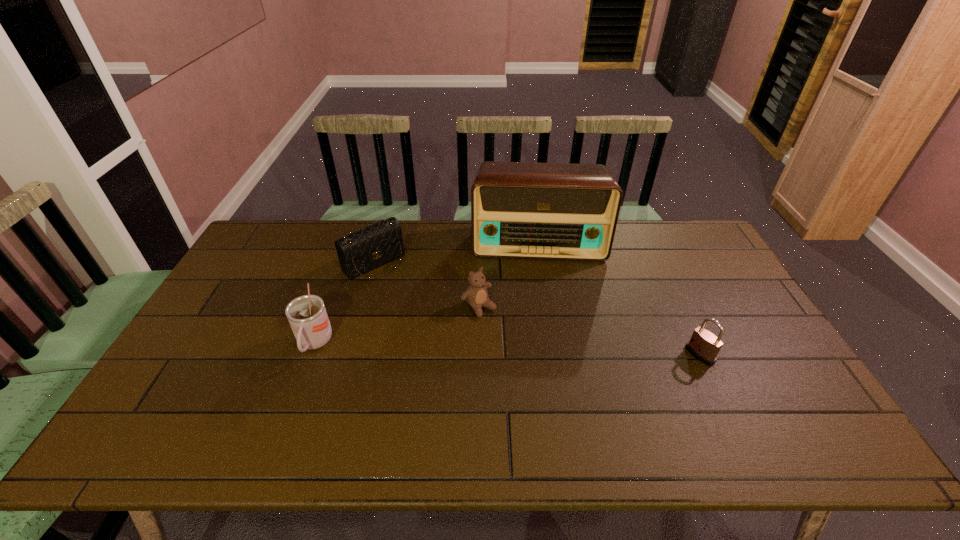
Locate an element on the screen. This screenshot has width=960, height=540. vacant space on the desktop that is between the cup and the padlock and is positioned on the front-facing side of the tallest object is located at coordinates (544, 350).

Image resolution: width=960 pixels, height=540 pixels. What are the coordinates of `free space on the desktop that is between the cup and the rightmost object and is positioned on the front flap of the clutch bag` in the screenshot? It's located at (462, 348).

Find the location of a particular element. The image size is (960, 540). vacant space on the desktop that is between the cup and the rightmost object and is positioned on the front-facing side of the teddy bear is located at coordinates (520, 350).